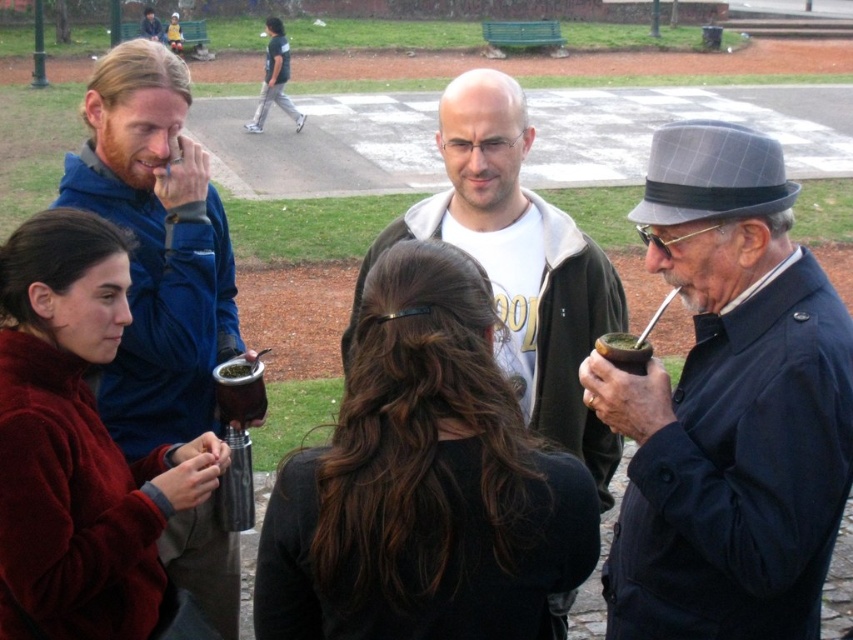
Question: Observing the image, what is the correct spatial positioning of dark blue jacket at center in reference to matte black mate cup at lower center?

Choices:
 (A) above
 (B) below

Answer: (A)

Question: Is velvet maroon sweater at lower left behind matte black mate cup at lower center?

Choices:
 (A) no
 (B) yes

Answer: (A)

Question: Among these points, which one is nearest to the camera?

Choices:
 (A) (257, 372)
 (B) (45, 625)
 (C) (706, 493)
 (D) (302, 564)

Answer: (D)

Question: Which point is farther to the camera?

Choices:
 (A) (122, 288)
 (B) (325, 524)

Answer: (A)

Question: Can you confirm if dark blue jacket at center is smaller than dark gray pants at upper center?

Choices:
 (A) yes
 (B) no

Answer: (A)

Question: Based on their relative distances, which object is nearer to the dark brown hair at center?

Choices:
 (A) velvet maroon sweater at lower left
 (B) dark blue jacket at center
 (C) dark gray pants at upper center

Answer: (B)